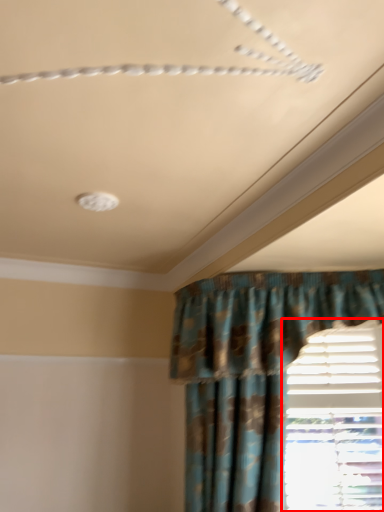
Question: In this image, where is window (annotated by the red box) located relative to curtain?

Choices:
 (A) right
 (B) left

Answer: (A)